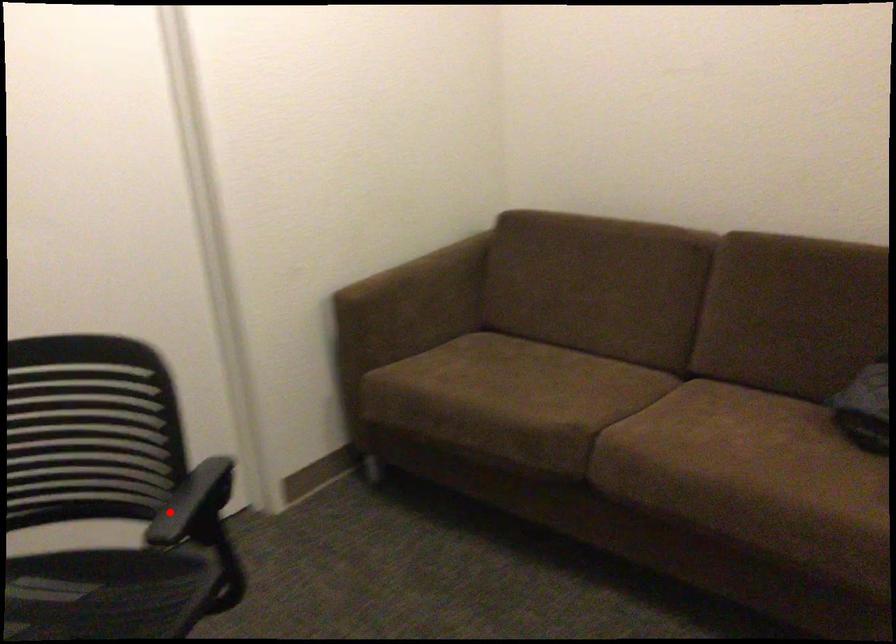
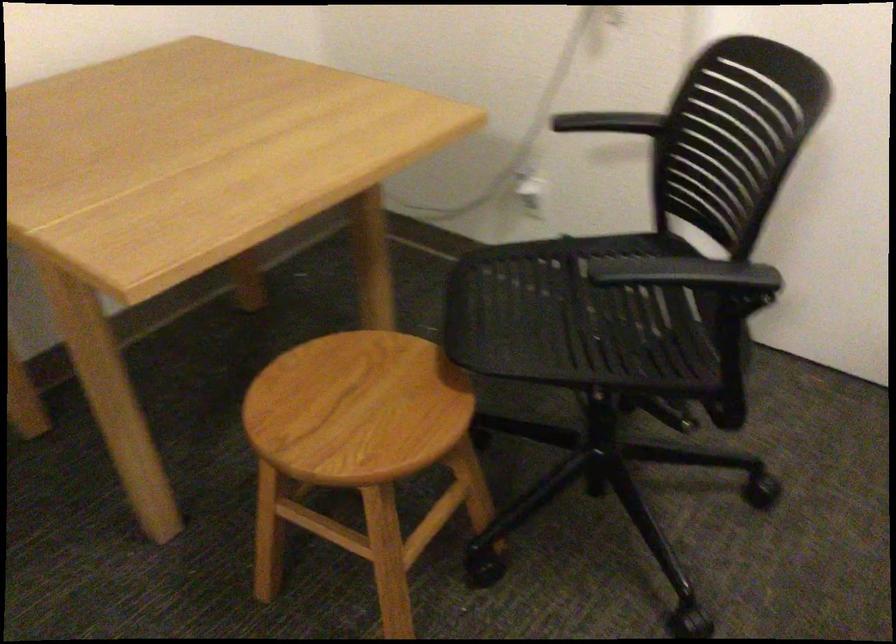
Find the pixel in the second image that matches the highlighted location in the first image.

(685, 272)